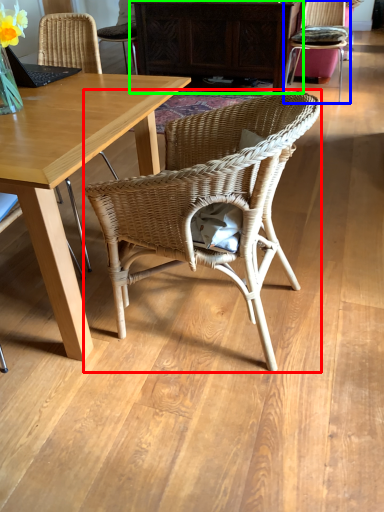
Question: Considering the real-world distances, which object is closest to chair (highlighted by a red box)? chair (highlighted by a blue box) or cabinetry (highlighted by a green box).

Choices:
 (A) chair
 (B) cabinetry

Answer: (B)